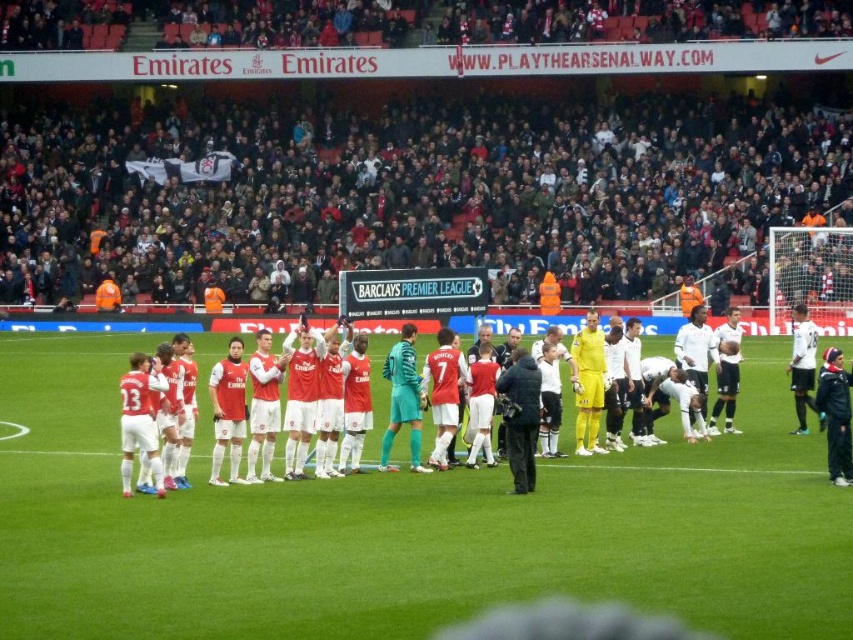
Question: Can you confirm if dark gray crowd at upper center is positioned to the right of black fabric camera at center?

Choices:
 (A) no
 (B) yes

Answer: (A)

Question: Which of the following is the farthest from the observer?

Choices:
 (A) dark gray crowd at upper center
 (B) black fabric camera at center

Answer: (A)

Question: Which object is closer to the camera taking this photo?

Choices:
 (A) matte red jersey at center
 (B) dark gray crowd at upper center
 (C) green grass field at center
 (D) black fabric camera at center

Answer: (C)

Question: Which point appears closest to the camera in this image?

Choices:
 (A) (692, 99)
 (B) (515, 392)
 (C) (293, 372)
 (D) (91, 532)

Answer: (D)

Question: Is green grass field at center positioned at the back of black fabric camera at center?

Choices:
 (A) no
 (B) yes

Answer: (A)

Question: Does green grass field at center have a greater width compared to matte red jersey at center?

Choices:
 (A) yes
 (B) no

Answer: (A)